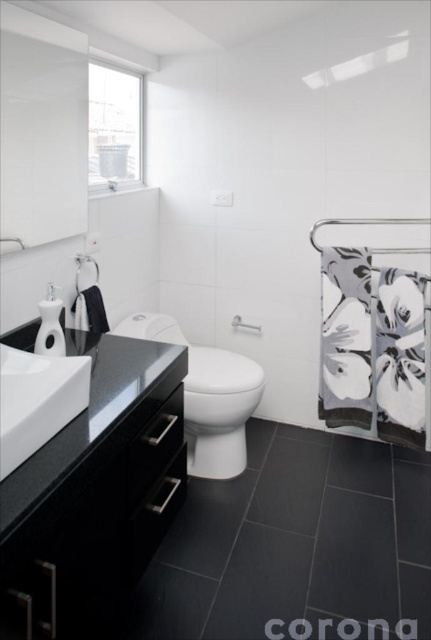
Between white glossy toilet bowl at center and white glossy sink at center, which one appears on the left side from the viewer's perspective?

white glossy sink at center is more to the left.

Can you confirm if white glossy toilet bowl at center is positioned above white glossy sink at center?

No, white glossy toilet bowl at center is not above white glossy sink at center.

Is point (234, 384) in front of point (18, 458)?

No.

Where is `white glossy toilet bowl at center`? The width and height of the screenshot is (431, 640). white glossy toilet bowl at center is located at coordinates (208, 396).

Is white glossy toilet bowl at center further to the viewer compared to white glossy shower at upper center?

No, it is in front of white glossy shower at upper center.

Measure the distance between point (190, 388) and camera.

A distance of 6.95 feet exists between point (190, 388) and camera.

Image resolution: width=431 pixels, height=640 pixels. In order to click on white glossy toilet bowl at center in this screenshot , I will do `click(208, 396)`.

Is point (83, 253) in front of point (50, 292)?

That is False.

Is white glossy shower at upper center bigger than white glossy faucet at upper left?

No, white glossy shower at upper center is not bigger than white glossy faucet at upper left.

Is point (84, 259) less distant than point (50, 300)?

That is False.

The width and height of the screenshot is (431, 640). I want to click on white glossy shower at upper center, so click(x=86, y=260).